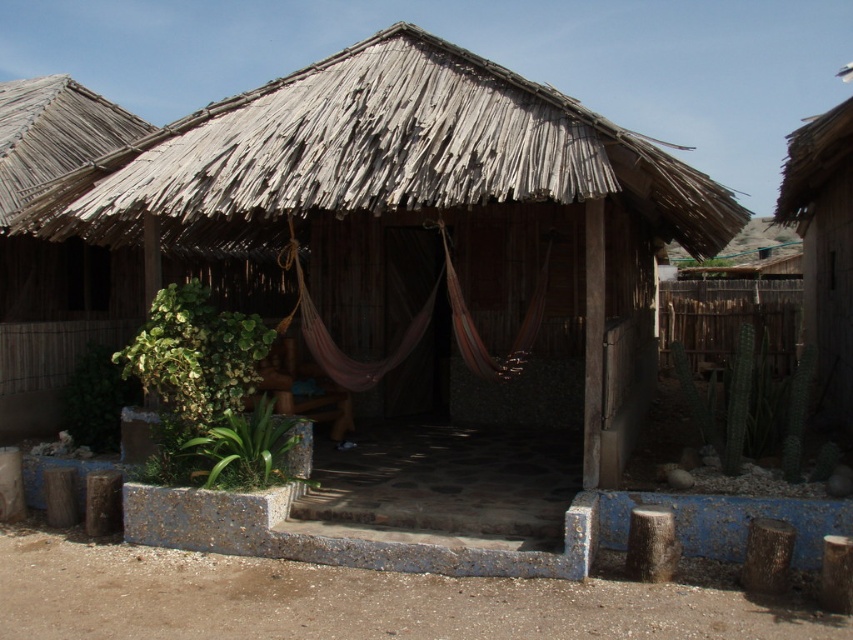
You are standing at the entrance of the rustic tropical hut and want to place a small potted plant between the two points labeled point [108,211] and point [808,227]. Which point should the potted plant be closer to so it is positioned in front of the other point?

The potted plant should be placed closer to point [108,211] because it is in front of point [808,227].

Based on the photo, you are standing in front of the tropical hut and want to touch both the natural thatch roof at center and the wooden hut at right. Which object will you reach first?

The natural thatch roof at center is closer to the viewer than the wooden hut at right, so you will reach the natural thatch roof at center first.

Consider the image. You are designing a model of the rustic tropical hut scene. The natural thatch roof at center and wooden hut at right must be included. Which object should you make smaller in your model to maintain the correct spatial relationship?

The natural thatch roof at center should be made smaller because it occupies less space than the wooden hut at right according to the description.